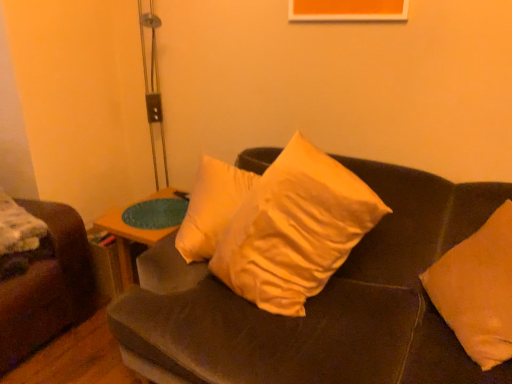
This screenshot has height=384, width=512. Identify the location of free space above woodenwoodentable at center (from a real-world perspective). (159, 210).